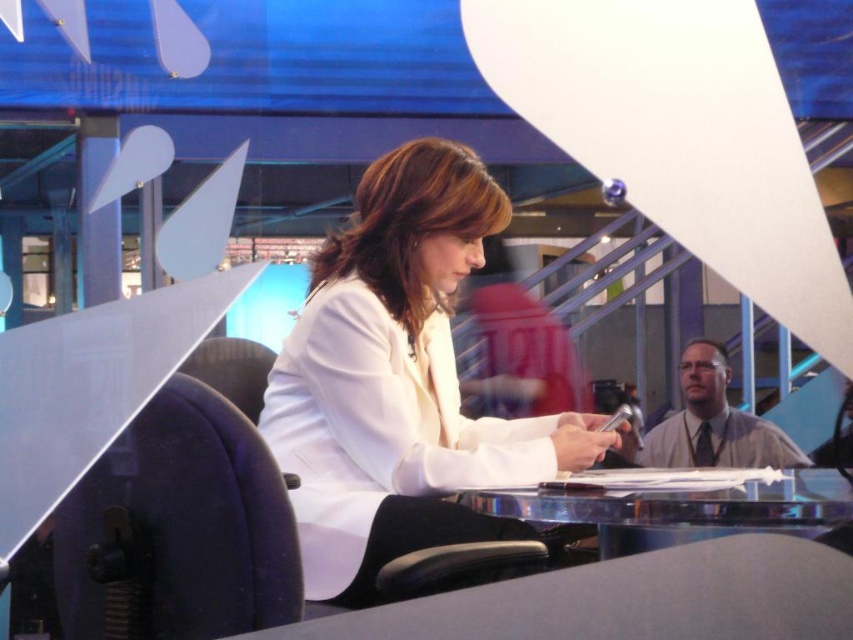
You are a costume designer preparing for a live broadcast. You need to ensure that the white matte jacket at center does not slip off the clear glass table at center. Based on their sizes, is the jacket likely to stay in place?

The white matte jacket at center is taller than clear glass table at center, so the jacket may not stay in place as it could extend beyond the table edges, increasing the risk of slipping.

You are a guest speaker who needs to sit down in the studio. There is a black fabric swivel chair at left and a clear glass table at center. Which object should you sit on?

You should sit on the black fabric swivel chair at left because it is designed for sitting, while the clear glass table at center is meant for placing items and not for sitting.

From the picture: In the news studio scene, there is a white matte jacket at center and a clear glass table at center. Which object is positioned to the left when viewed from the front?

The white matte jacket at center is to the left of the clear glass table at center.